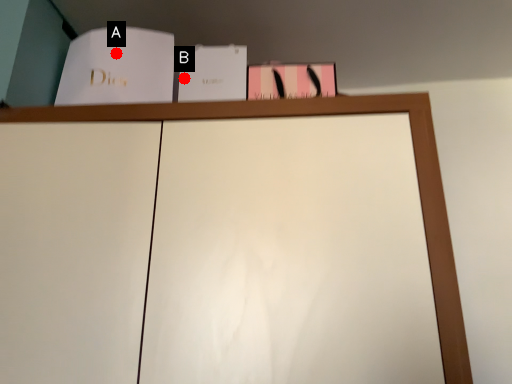
Question: Two points are circled on the image, labeled by A and B beside each circle. Among these points, which one is nearest to the camera?

Choices:
 (A) A is closer
 (B) B is closer

Answer: (A)